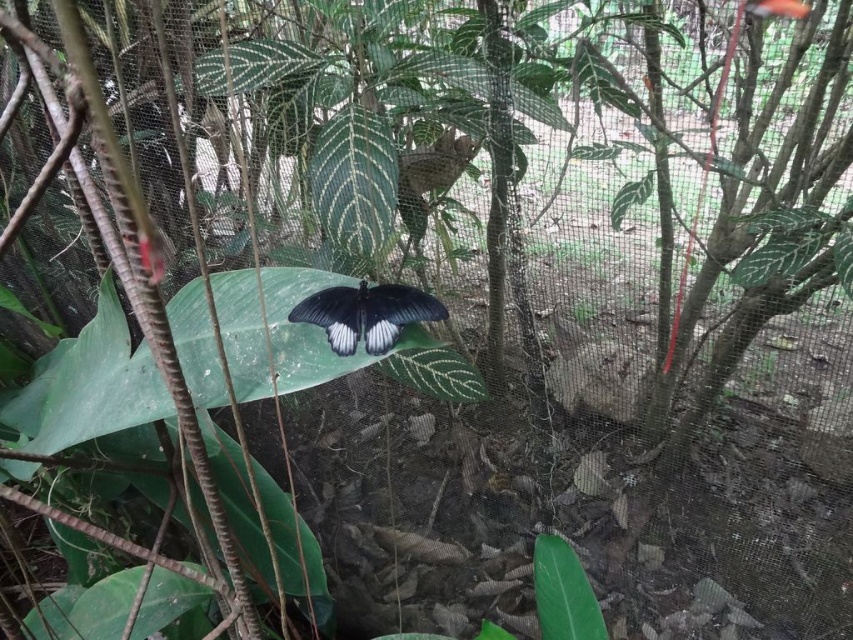
Question: Considering the relative positions of black glossy butterfly at center and green glossy leaf at upper center in the image provided, where is black glossy butterfly at center located with respect to green glossy leaf at upper center?

Choices:
 (A) below
 (B) above

Answer: (A)

Question: Which point is closer to the camera?

Choices:
 (A) (796, 252)
 (B) (549, 621)
 (C) (445, 384)
 (D) (381, 236)

Answer: (A)

Question: Which point appears farthest from the camera in this image?

Choices:
 (A) (418, 339)
 (B) (347, 109)

Answer: (B)

Question: Which of the following is the closest to the observer?

Choices:
 (A) green textured leaf at upper right
 (B) green glossy leaf at center

Answer: (A)

Question: Can you confirm if green textured leaf at center is bigger than green glossy leaf at upper center?

Choices:
 (A) yes
 (B) no

Answer: (A)

Question: Can you confirm if green glossy leaf at upper center is thinner than green glossy leaf at center?

Choices:
 (A) yes
 (B) no

Answer: (B)